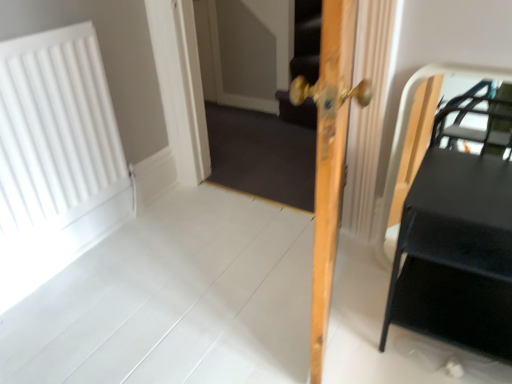
This screenshot has height=384, width=512. I want to click on vacant space in front of white matte radiator at left, so click(80, 309).